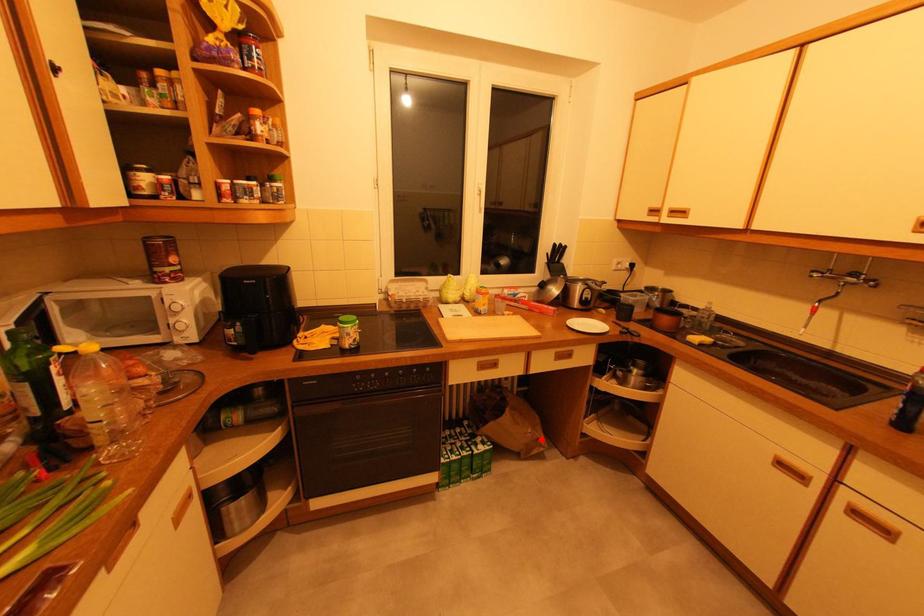
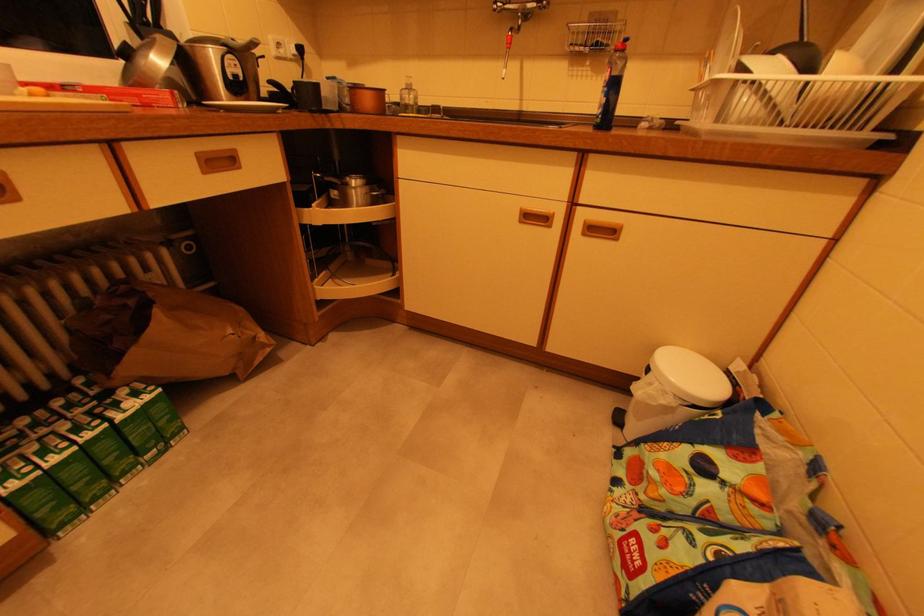
Question: I am providing you with two images of the same scene from different viewpoints. In image1, a red point is highlighted. Considering the same 3D point in image2, which of the following is correct?

Choices:
 (A) It is closer
 (B) It is farther

Answer: (A)